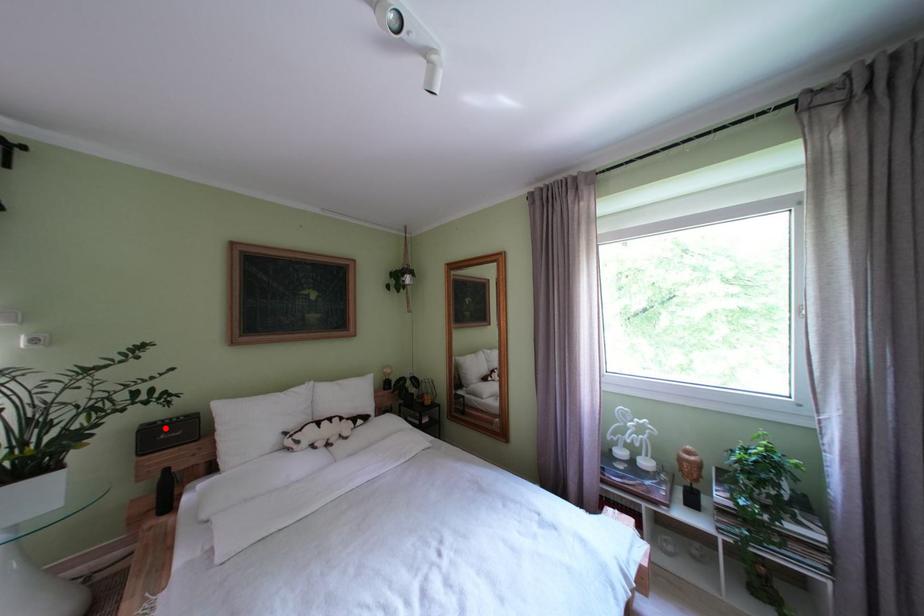
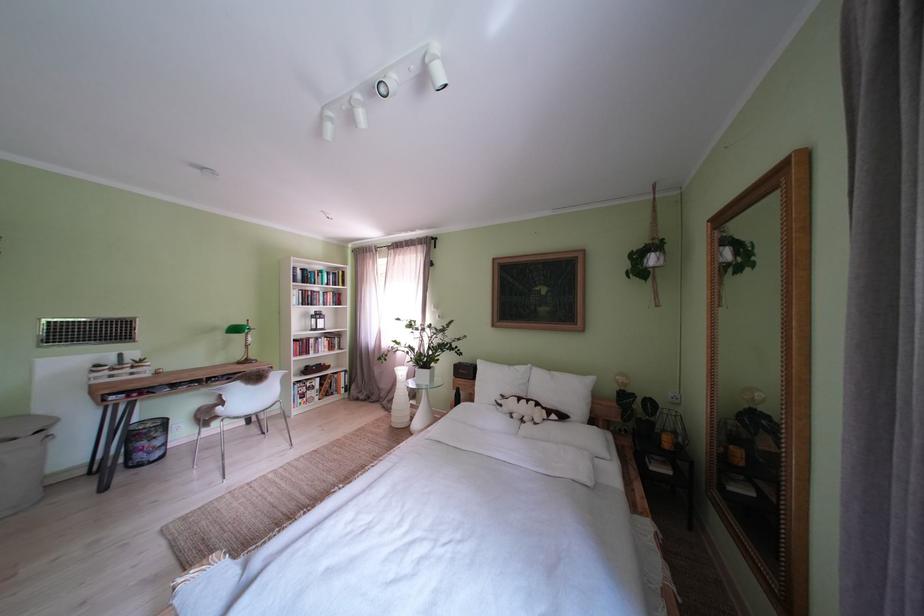
Question: I am providing you with two images of the same scene from different viewpoints. A red point is marked on the first image. Can you still see the location of the red point in image 2?

Choices:
 (A) Yes
 (B) No

Answer: (A)